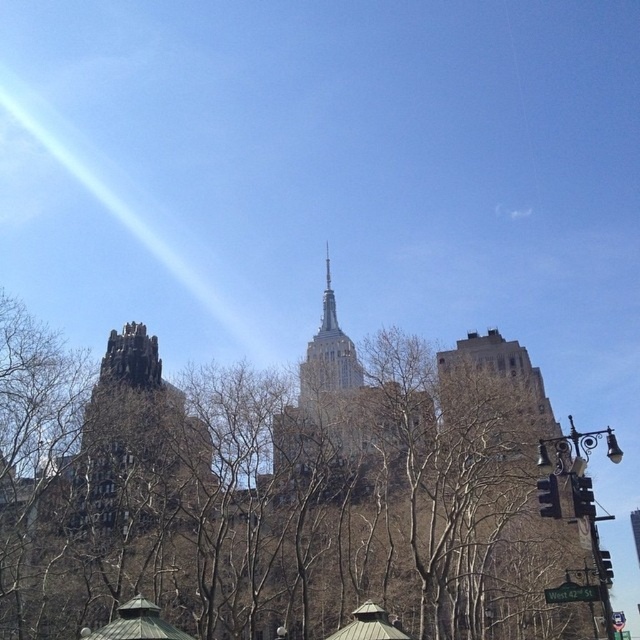
Looking at this image, who is lower down, brown leafless tree at center or dark gray stone tower at left?

dark gray stone tower at left is below.

Between point (156, 392) and point (115, 424), which one is positioned behind?

The point (156, 392) is more distant.

Locate an element on the screen. brown leafless tree at center is located at coordinates (276, 500).

From the picture: Between brown stone building at right and dark gray stone tower at left, which one is positioned lower?

brown stone building at right is below.

Does brown stone building at right appear on the left side of dark gray stone tower at left?

Incorrect, brown stone building at right is not on the left side of dark gray stone tower at left.

Between point (513, 554) and point (161, 387), which one is positioned in front?

Point (513, 554)

Find the location of a particular element. Image resolution: width=640 pixels, height=640 pixels. brown stone building at right is located at coordinates (522, 490).

Can you confirm if brown leafless tree at center is thinner than brown stone building at right?

No, brown leafless tree at center is not thinner than brown stone building at right.

Which is above, brown leafless tree at center or brown stone building at right?

brown leafless tree at center is above.

Does point (160, 604) come closer to viewer compared to point (449, 381)?

Yes, it is in front of point (449, 381).

The height and width of the screenshot is (640, 640). Identify the location of brown leafless tree at center. (276, 500).